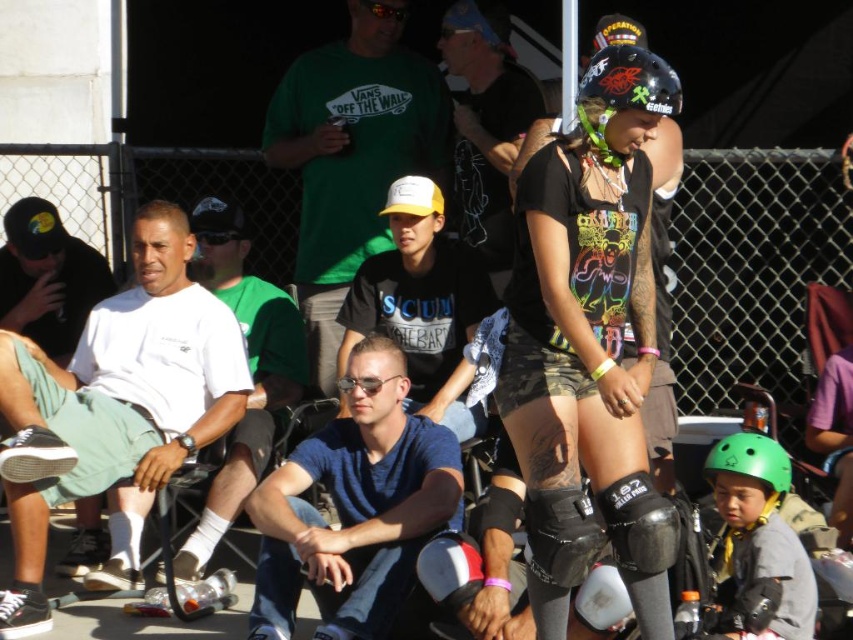
You are standing in the skate park and see two points marked in the image. Which point is closer to you, point (35, 264) or point (618, 76)?

Point (35, 264) is closer to you because it is further to the viewer than point (618, 76).

You are a photographer trying to capture a clear shot of the black matte shirt at center and the black matte knee pad at center. Based on their positions, can you tell which one is closer to the camera?

The black matte shirt at center is above the black matte knee pad at center, so the knee pad is closer to the camera since it is positioned lower in the image.